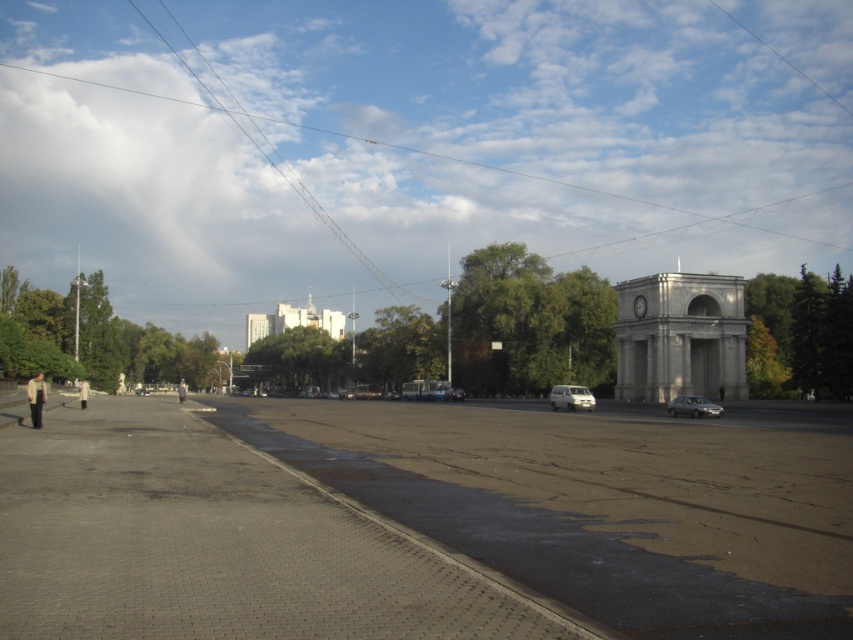
You are standing at the center of the urban square and see a point marked at coordinates (572, 397). What object is located at that point?

The point at coordinates (572, 397) indicates the white matte van at center.

You are standing at the center of the urban square and want to find the green leafy tree at left. Based on the coordinates provided, in which direction should you look to locate it?

The green leafy tree at left is located at coordinates point (97,340), which means it is positioned to the left side of the square. Therefore, you should look to your left to locate the green leafy tree at left.